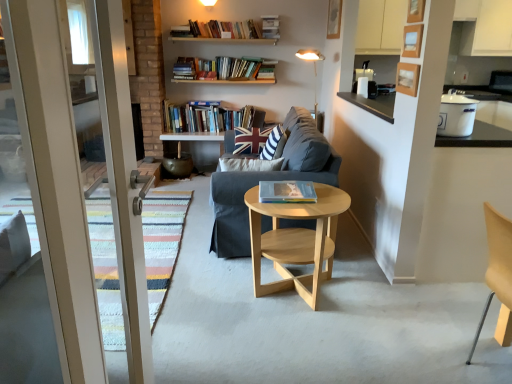
This screenshot has width=512, height=384. What are the coordinates of `free space above light wood/woodenobject at center (from a real-world perspective)` in the screenshot? It's located at point(310,202).